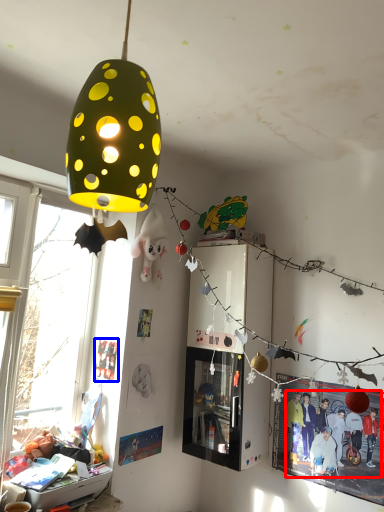
Question: Which point is further to the camera, person (highlighted by a red box) or poster page (highlighted by a blue box)?

Choices:
 (A) person
 (B) poster page

Answer: (B)